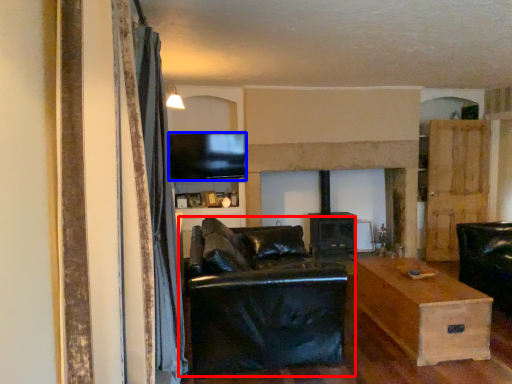
Question: Which object appears farthest to the camera in this image, studio couch (highlighted by a red box) or television (highlighted by a blue box)?

Choices:
 (A) studio couch
 (B) television

Answer: (B)